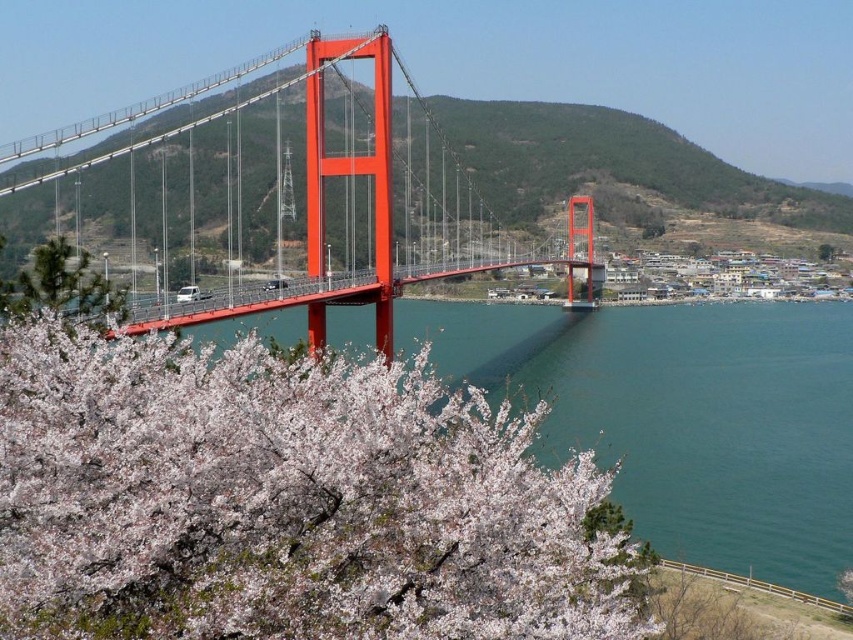
Describe the element at coordinates (683, 417) in the screenshot. I see `clear blue water at lower center` at that location.

Between point (747, 544) and point (83, 312), which one is positioned behind?

The point (747, 544) is behind.

Locate an element on the screen. The height and width of the screenshot is (640, 853). clear blue water at lower center is located at coordinates (683, 417).

From the picture: Is clear blue water at lower center positioned behind bright orange bridge at center?

That is False.

At what (x,y) coordinates should I click in order to perform the action: click on clear blue water at lower center. Please return your answer as a coordinate pair (x, y). The height and width of the screenshot is (640, 853). Looking at the image, I should click on (683, 417).

The image size is (853, 640). What are the coordinates of `clear blue water at lower center` in the screenshot? It's located at (x=683, y=417).

Which is behind, point (345, 163) or point (9, 284)?

Positioned behind is point (345, 163).

Who is more distant from viewer, (x=386, y=51) or (x=85, y=321)?

Point (x=386, y=51)

You are a GUI agent. You are given a task and a screenshot of the screen. Output one action in this format:
    pyautogui.click(x=<x>, y=<y>)
    Task: Click on the bright orange bridge at center
    
    Given the screenshot: What is the action you would take?
    pyautogui.click(x=343, y=195)